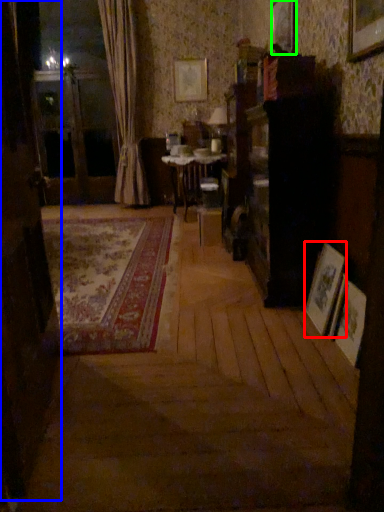
Question: Estimate the real-world distances between objects in this image. Which object is farther from picture frame (highlighted by a red box), screen door (highlighted by a blue box) or picture frame (highlighted by a green box)?

Choices:
 (A) screen door
 (B) picture frame

Answer: (B)